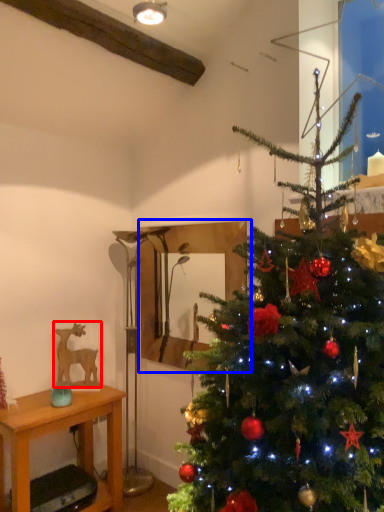
Question: Which point is further to the camera, animal (highlighted by a red box) or mirror (highlighted by a blue box)?

Choices:
 (A) animal
 (B) mirror

Answer: (A)